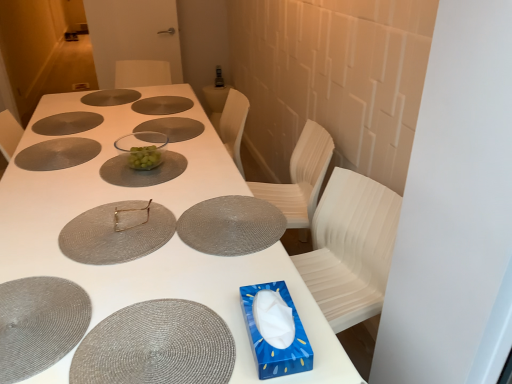
I want to click on unoccupied space behind matte gray glass plate at upper left, which is counted as the 7th glass plate, starting from the front, so click(x=81, y=99).